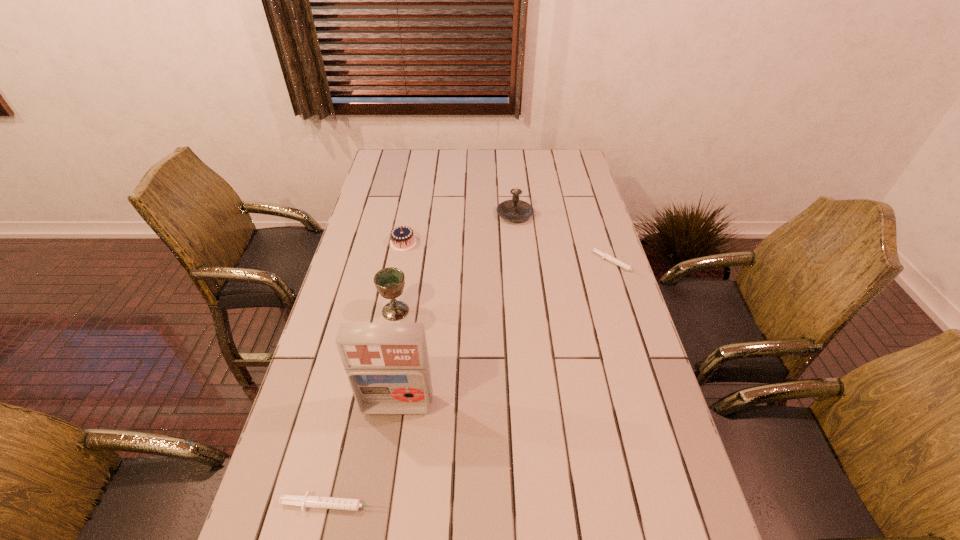
Identify the location of the first-aid kit that is at the left edge. The height and width of the screenshot is (540, 960). (387, 364).

Where is `object present at the right edge`? Image resolution: width=960 pixels, height=540 pixels. object present at the right edge is located at coordinates (623, 265).

The height and width of the screenshot is (540, 960). I want to click on object that is at the near left corner, so click(x=349, y=504).

Where is `free region at the far edge of the desktop`? This screenshot has width=960, height=540. free region at the far edge of the desktop is located at coordinates (479, 156).

The height and width of the screenshot is (540, 960). In the image, there is a desktop. In order to click on free space at the near edge in this screenshot , I will do `click(606, 531)`.

In the image, there is a desktop. In order to click on free space at the left edge in this screenshot , I will do `click(384, 219)`.

Identify the location of vacant space at the right edge of the desktop. (562, 228).

The image size is (960, 540). In the image, there is a desktop. What are the coordinates of `free space at the far left corner` in the screenshot? It's located at (393, 160).

Image resolution: width=960 pixels, height=540 pixels. Identify the location of free region at the far right corner of the desktop. (578, 161).

At what (x,y) coordinates should I click in order to perform the action: click on vacant area that lies between the shorter syringe and the third nearest object. Please return your answer as a coordinate pair (x, y). The image size is (960, 540). Looking at the image, I should click on (506, 288).